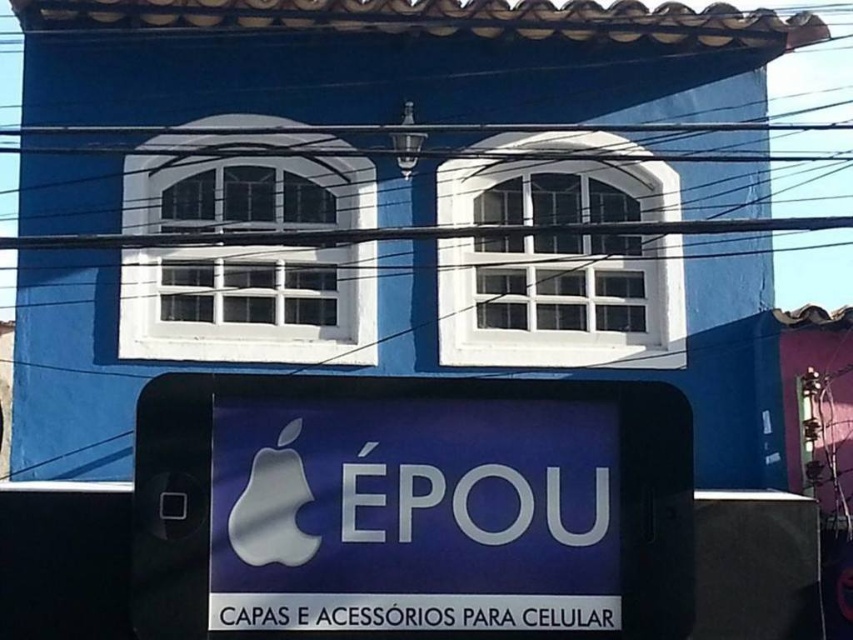
Question: From the image, what is the correct spatial relationship of white plastic phone at center in relation to satin silver apple at center?

Choices:
 (A) below
 (B) above

Answer: (A)

Question: Can you confirm if white plastic phone at center is wider than satin silver apple at center?

Choices:
 (A) yes
 (B) no

Answer: (A)

Question: Which point is closer to the camera taking this photo?

Choices:
 (A) (276, 522)
 (B) (401, 634)

Answer: (A)

Question: Does white plastic phone at center appear on the right side of satin silver apple at center?

Choices:
 (A) yes
 (B) no

Answer: (A)

Question: Which of the following is the farthest from the observer?

Choices:
 (A) (271, 502)
 (B) (532, 605)

Answer: (B)